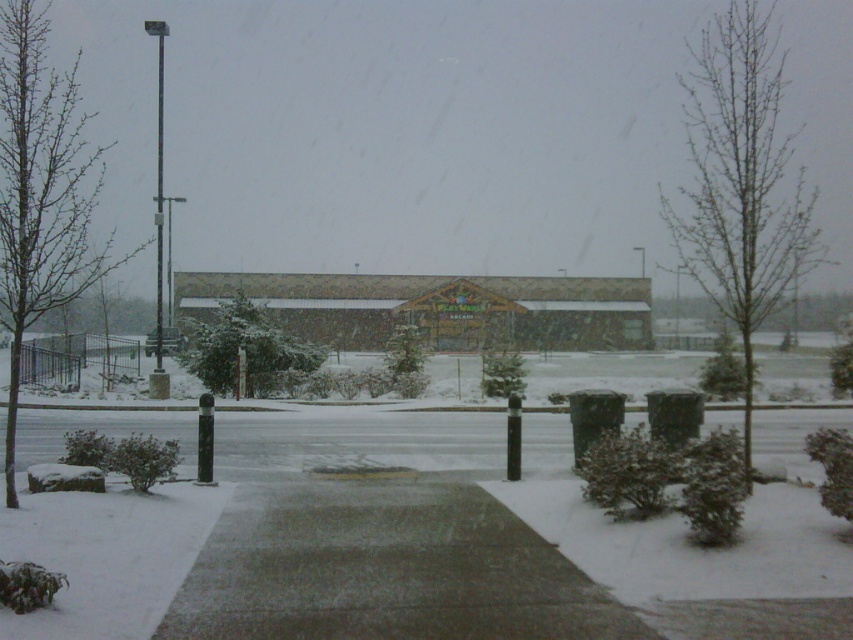
Is point (549, 566) farther from camera compared to point (157, 125)?

That is False.

Can you confirm if gray concrete sidewalk at center is positioned to the left of metallic pole at left?

In fact, gray concrete sidewalk at center is to the right of metallic pole at left.

The height and width of the screenshot is (640, 853). What do you see at coordinates (386, 570) in the screenshot? I see `gray concrete sidewalk at center` at bounding box center [386, 570].

Locate an element on the screen. This screenshot has height=640, width=853. gray concrete sidewalk at center is located at coordinates (386, 570).